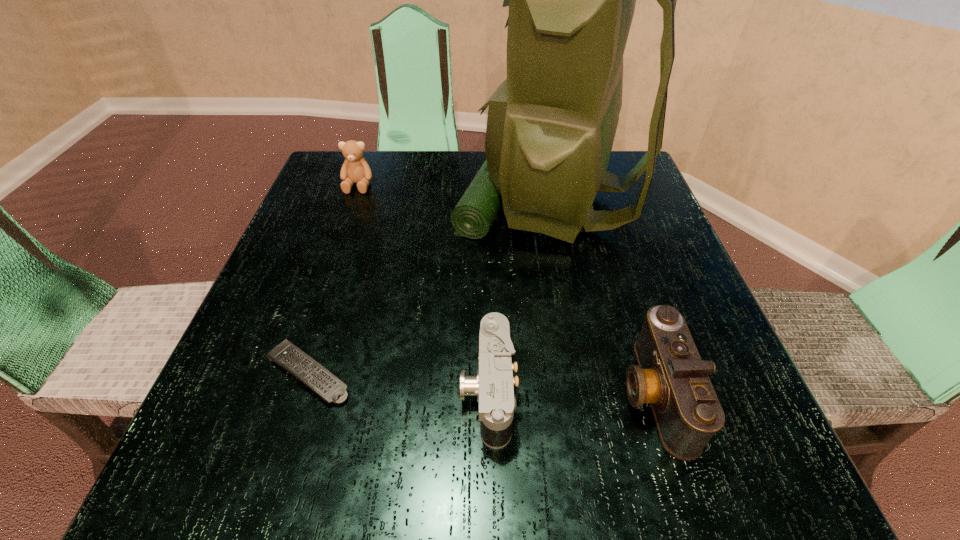
Locate an element on the screen. This screenshot has height=540, width=960. the tallest object is located at coordinates (551, 124).

At what (x,y) coordinates should I click in order to perform the action: click on teddy bear. Please return your answer as a coordinate pair (x, y). This screenshot has width=960, height=540. Looking at the image, I should click on (355, 169).

Image resolution: width=960 pixels, height=540 pixels. Find the location of `the right camera`. the right camera is located at coordinates (670, 375).

The image size is (960, 540). In order to click on the left camera in this screenshot , I will do `click(493, 385)`.

Find the location of a particular element. The width and height of the screenshot is (960, 540). the shorter camera is located at coordinates (493, 385).

At what (x,y) coordinates should I click in order to perform the action: click on the shortest object. Please return your answer as a coordinate pair (x, y). Looking at the image, I should click on (330, 388).

The image size is (960, 540). Find the location of `blank area located on the front of the tallest object with visible pockets`. blank area located on the front of the tallest object with visible pockets is located at coordinates (377, 200).

The image size is (960, 540). Identify the location of vacant space located on the front of the tallest object with visible pockets. (341, 200).

At what (x,y) coordinates should I click in order to perform the action: click on vacant space located 0.110m on the front of the tallest object with visible pockets. Please return your answer as a coordinate pair (x, y). The width and height of the screenshot is (960, 540). Looking at the image, I should click on (404, 200).

At what (x,y) coordinates should I click in order to perform the action: click on vacant space situated 0.260m on the front-facing side of the teddy bear. Please return your answer as a coordinate pair (x, y). The height and width of the screenshot is (540, 960). Looking at the image, I should click on (326, 276).